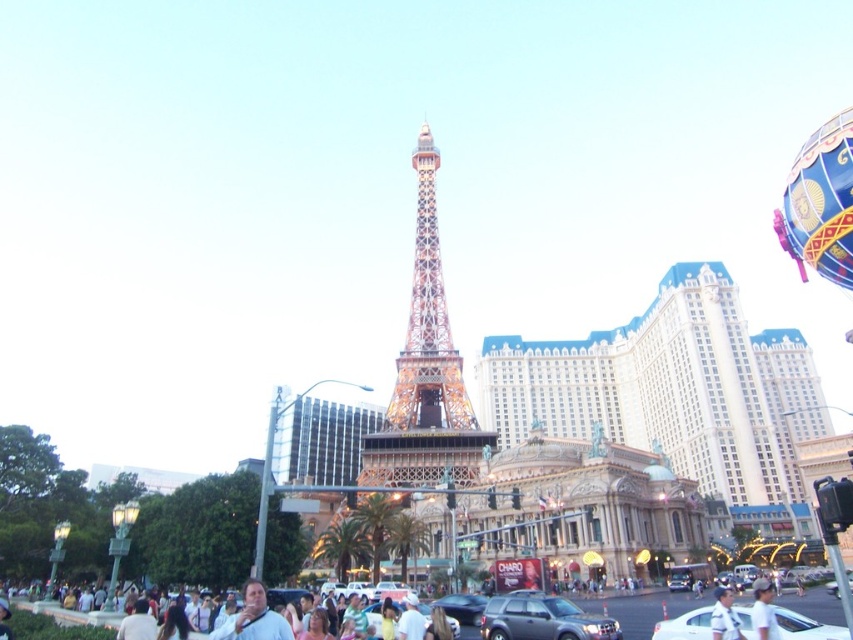
Question: Which point is farther to the camera?

Choices:
 (A) (544, 627)
 (B) (705, 616)
 (C) (421, 314)

Answer: (C)

Question: Which point is farther to the camera?

Choices:
 (A) white glossy car at lower center
 (B) shiny metallic eiffel tower at center
 (C) white matte crowd at lower center
 (D) white matte shirt at center

Answer: (B)

Question: Does white glossy car at lower center appear under white matte crowd at lower center?

Choices:
 (A) no
 (B) yes

Answer: (A)

Question: Does matte black suv at center have a larger size compared to white matte helmet at center?

Choices:
 (A) no
 (B) yes

Answer: (A)

Question: Among these points, which one is farthest from the camera?

Choices:
 (A) (552, 609)
 (B) (769, 630)

Answer: (A)

Question: Is white matte crowd at lower center smaller than white matte shirt at center?

Choices:
 (A) no
 (B) yes

Answer: (B)